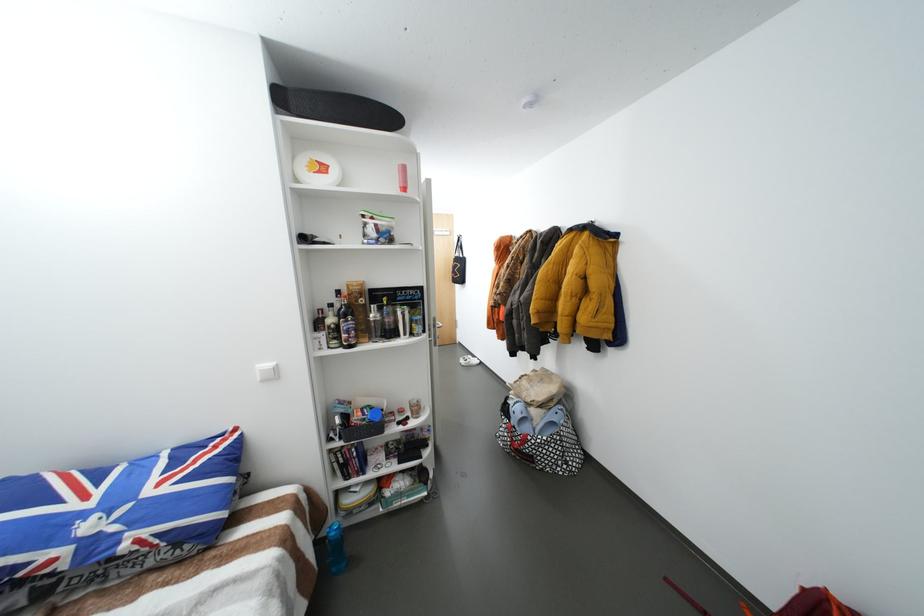
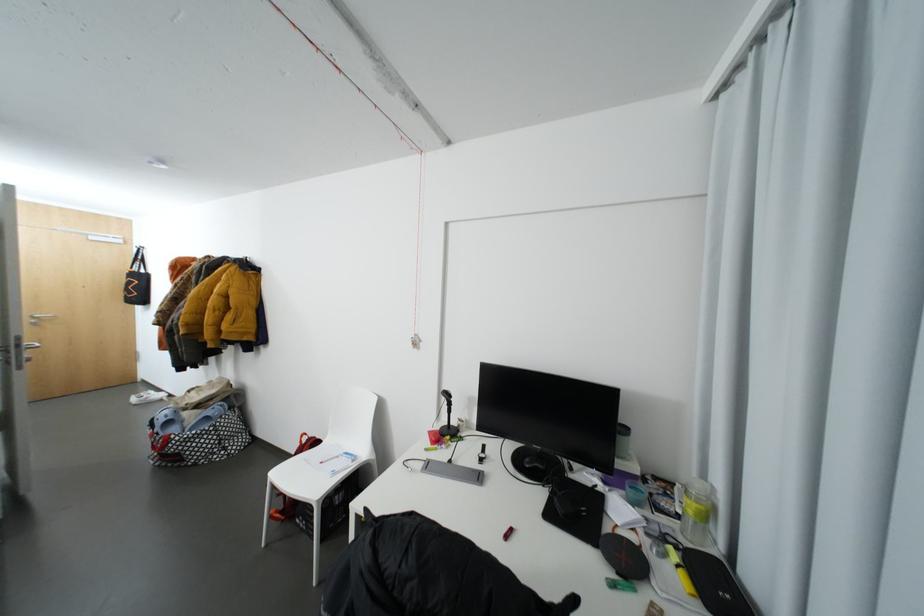
In the second image, find the point that corresponds to [442,321] in the first image.

(26, 339)